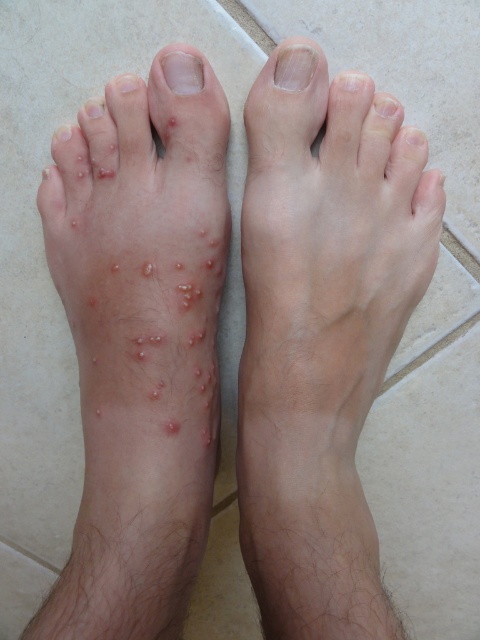
Question: From the image, what is the correct spatial relationship of dry skin at upper right in relation to clear nail at upper left?

Choices:
 (A) right
 (B) left

Answer: (A)

Question: Based on their relative distances, which object is farther from the dry skin at upper right?

Choices:
 (A) dry skin patches at left
 (B) clear skin at upper right
 (C) matte skin toe at center

Answer: (A)

Question: Which object is closer to the camera taking this photo?

Choices:
 (A) clear nail at upper left
 (B) dry skin patches at left
 (C) matte skin toe at center

Answer: (B)

Question: From the image, what is the correct spatial relationship of dry skin patches at left in relation to dry skin at upper right?

Choices:
 (A) right
 (B) left

Answer: (B)

Question: Which point is farther from the camera taking this photo?

Choices:
 (A) [x=340, y=577]
 (B) [x=129, y=76]
 (C) [x=305, y=49]
 (D) [x=117, y=253]

Answer: (B)

Question: Is smooth skin leg at center to the left of clear nail at upper left from the viewer's perspective?

Choices:
 (A) yes
 (B) no

Answer: (B)